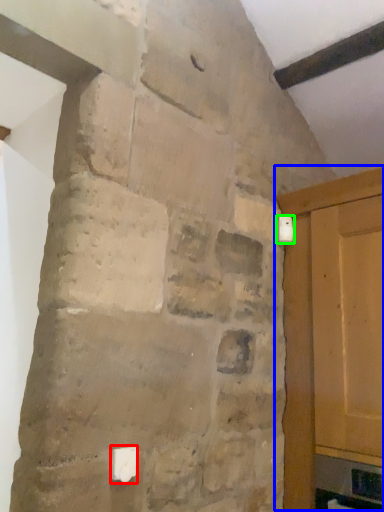
Question: Based on their relative distances, which object is farther from light switch (highlighted by a red box)? Choose from door (highlighted by a blue box) and light switch (highlighted by a green box).

Choices:
 (A) door
 (B) light switch

Answer: (B)